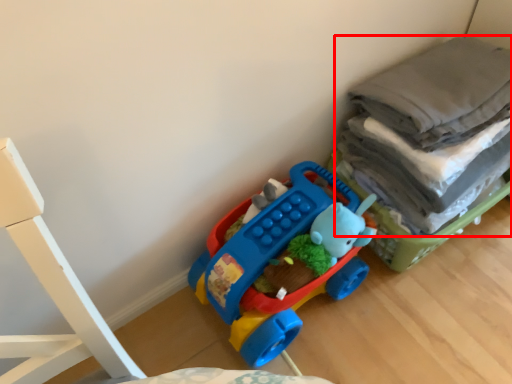
Question: From the image's perspective, what is the correct spatial relationship of laundry (annotated by the red box) in relation to toy?

Choices:
 (A) below
 (B) above

Answer: (B)